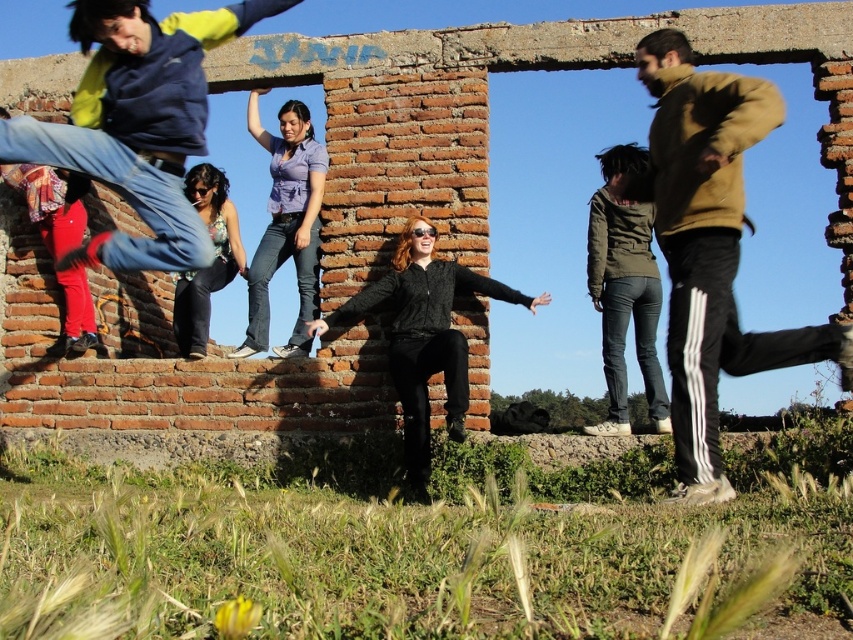
Question: Which point is closer to the camera?

Choices:
 (A) floral blouse at center
 (B) black matte sweater at center
 (C) blue denim jeans at upper left
 (D) denim jeans at center

Answer: (A)

Question: Is olive green fabric jacket at upper right smaller than floral blouse at center?

Choices:
 (A) no
 (B) yes

Answer: (B)

Question: Which object appears farthest from the camera in this image?

Choices:
 (A) blue denim jeans at upper left
 (B) denim jeans at center

Answer: (B)

Question: Is blue denim jeans at upper left to the right of olive green fabric jacket at upper right from the viewer's perspective?

Choices:
 (A) yes
 (B) no

Answer: (B)

Question: Which of the following is the closest to the observer?

Choices:
 (A) black matte sweater at center
 (B) denim jeans at center

Answer: (A)

Question: Is brown suede jacket at right closer to camera compared to blue denim jeans at upper left?

Choices:
 (A) yes
 (B) no

Answer: (A)